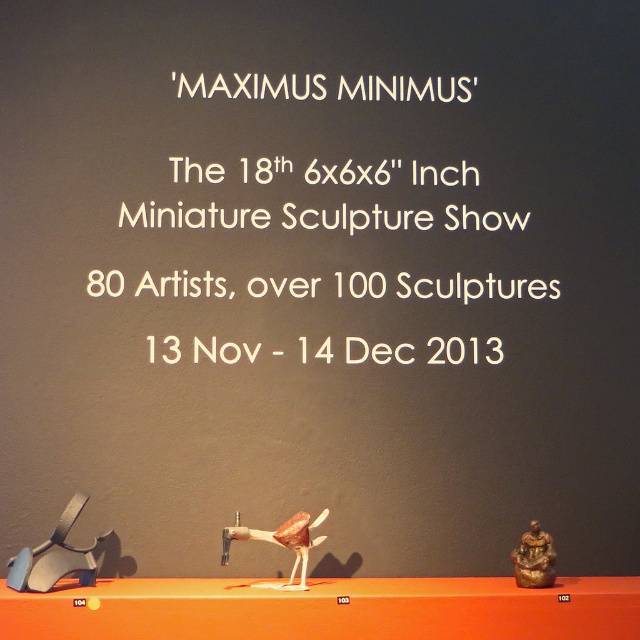
You are an event planner organizing the MAXIMUS MINIMUS exhibition. You need to place a decorative item that is 1.2 meters tall on the display. The white paper at center and the matte black chair at lower left are available. Which object can accommodate the height requirement?

The white paper at center is taller than the matte black chair at lower left, so the decorative item that is 1.2 meters tall can be placed on the white paper at center since it has sufficient height.

You are an event planner looking at the promotional display for the MAXIMUS MINIMUS exhibition. You need to place a small decorative item on the white paper at center. Given the coordinates of the white paper, can you confirm if it is positioned exactly in the center of the image?

The white paper at center is located at point coordinates of [317,196]. Since the coordinates are close to 0.5 on both axes, it is approximately centered in the image.